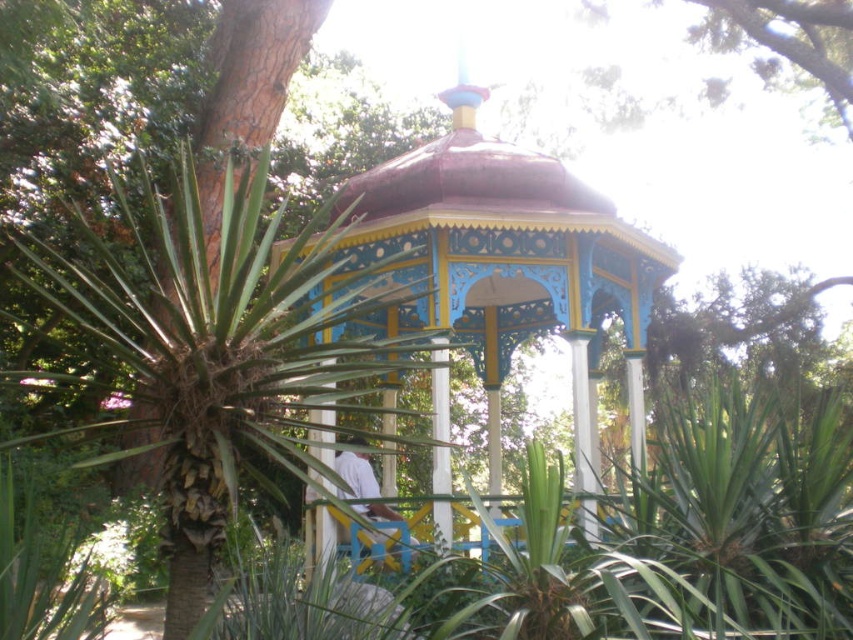
You are standing at the entrance of the gazebo and want to place a decorative pot exactly at the center of the gazebo. The gazebo is an octagonal structure. Where should you place the pot relative to the green leafy palm tree at center?

The green leafy palm tree at center is located at point (215, 349), so you should place the decorative pot at the center coordinates of the gazebo, which would be near the palm tree since it is already at the center point.

You are standing at the entrance of the gazebo and see the point marked at coordinates (215, 349). What object is located at that point?

The point marked at coordinates (215, 349) corresponds to the green leafy palm tree at center.